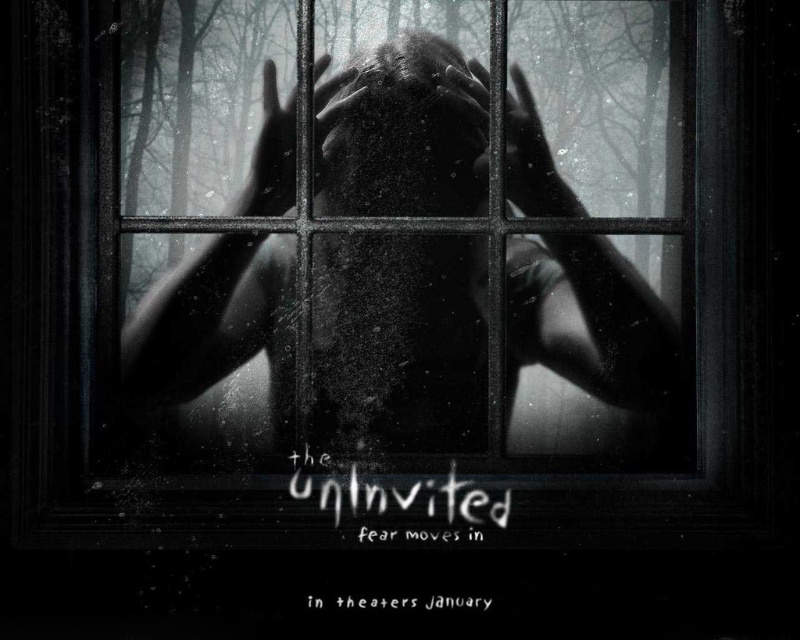
In the movie poster for The Uninvited, you notice two elements at the center of the image. There is a smooth skin face at center and a smooth skin hand at center. From the perspective of someone looking at the poster, which of these two elements is positioned closer to the viewer?

The smooth skin face at center is closer to the viewer because the smooth skin hand at center is behind it.